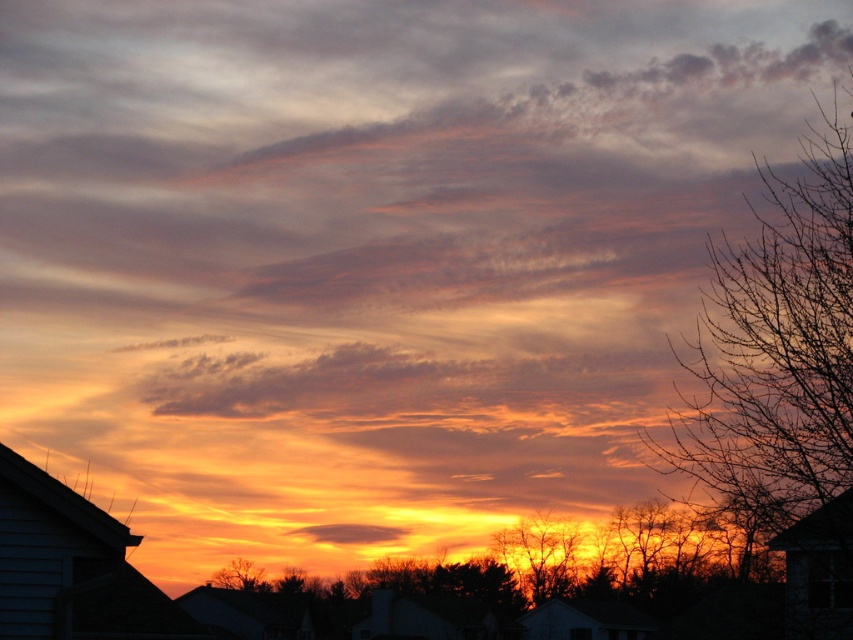
Can you confirm if orange-brown textured tree at center is thinner than matte orange cloud at center?

Incorrect, orange-brown textured tree at center's width is not less than matte orange cloud at center's.

Between orange-brown textured tree at center and matte orange cloud at center, which one appears on the right side from the viewer's perspective?

orange-brown textured tree at center is more to the right.

Identify the location of orange-brown textured tree at center. click(540, 554).

Locate an element on the screen. silvery branches at upper right is located at coordinates 775,353.

Can you confirm if silvery branches at upper right is positioned to the left of matte orange cloud at center?

In fact, silvery branches at upper right is to the right of matte orange cloud at center.

Does point (778, 248) come in front of point (370, 529)?

Yes, point (778, 248) is closer to viewer.

Locate an element on the screen. The image size is (853, 640). silvery branches at upper right is located at coordinates (775, 353).

Who is more forward, (785, 365) or (216, 577)?

Point (785, 365)

From the picture: Can you confirm if silvery branches at upper right is shorter than brown textured tree at lower center?

Incorrect, silvery branches at upper right's height does not fall short of brown textured tree at lower center's.

Looking at this image, who is more forward, (788,314) or (222,576)?

Point (788,314)

Where is `silvery branches at upper right`? silvery branches at upper right is located at coordinates (775, 353).